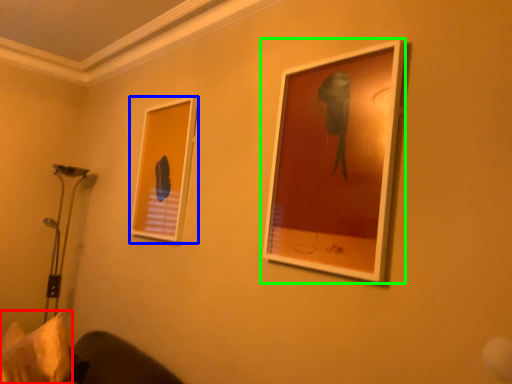
Question: Which object is positioned farthest from pillow (highlighted by a red box)? Select from picture frame (highlighted by a blue box) and picture frame (highlighted by a green box).

Choices:
 (A) picture frame
 (B) picture frame

Answer: (B)